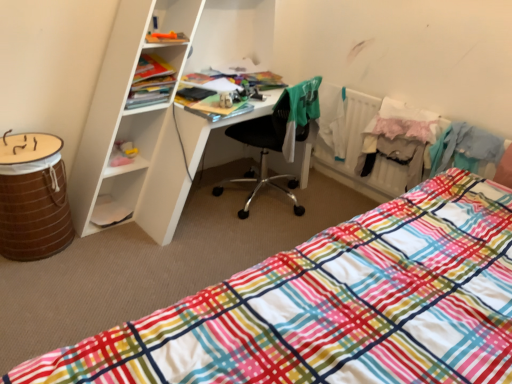
The height and width of the screenshot is (384, 512). Identify the location of free space in front of black plastic chair at center. (244, 240).